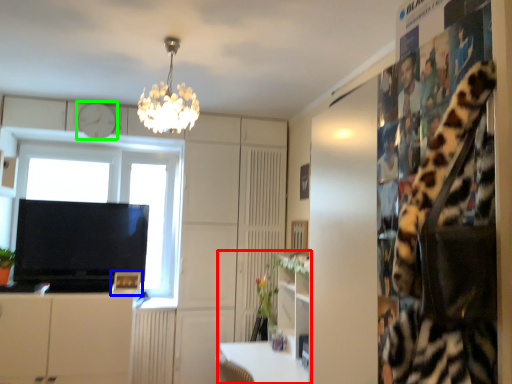
Question: Based on their relative distances, which object is farther from computer desk (highlighted by a red box)? Choose from picture frame (highlighted by a blue box) and clock (highlighted by a green box).

Choices:
 (A) picture frame
 (B) clock

Answer: (B)